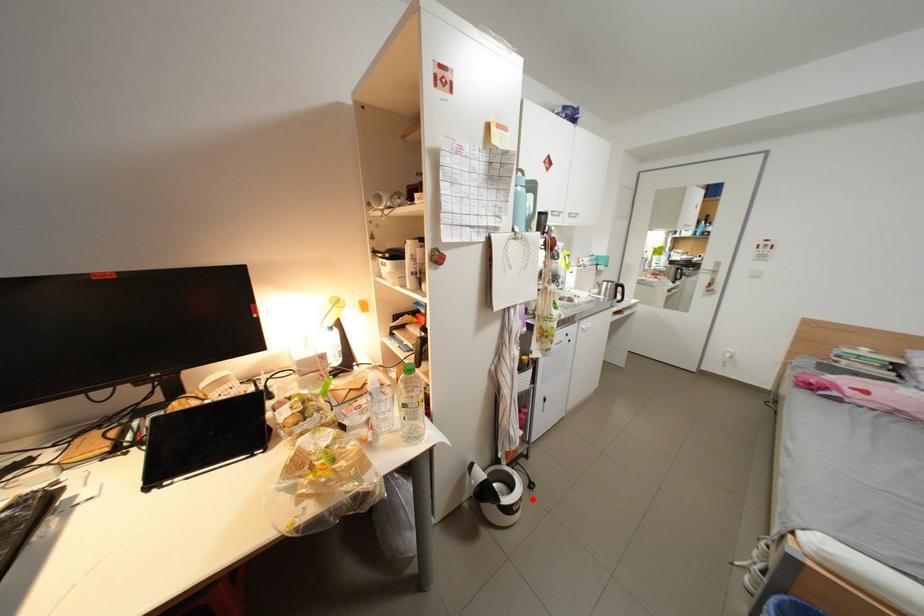
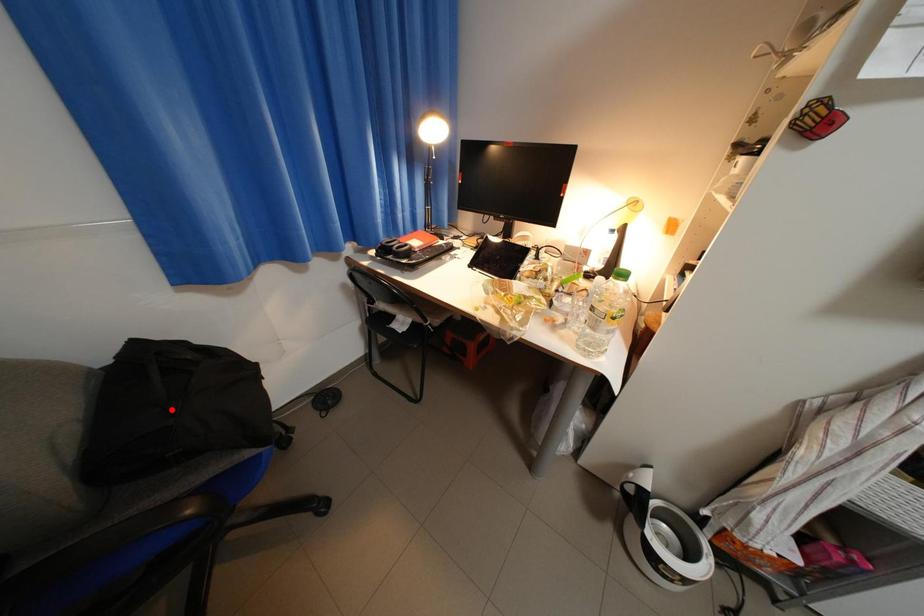
I am providing you with two images of the same scene from different viewpoints. A red point is marked on the first image and another point is marked on the second image. Are the points marked in image1 and image2 representing the same 3D position?

No